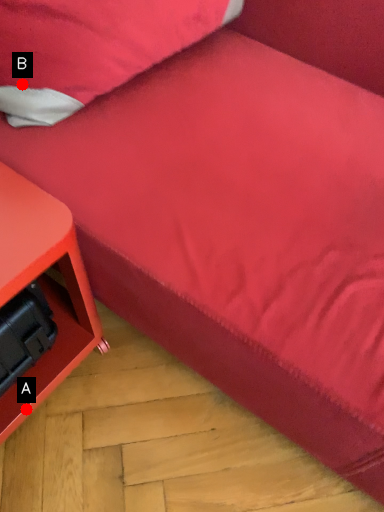
Question: Two points are circled on the image, labeled by A and B beside each circle. Which point is further to the camera?

Choices:
 (A) A is further
 (B) B is further

Answer: (A)